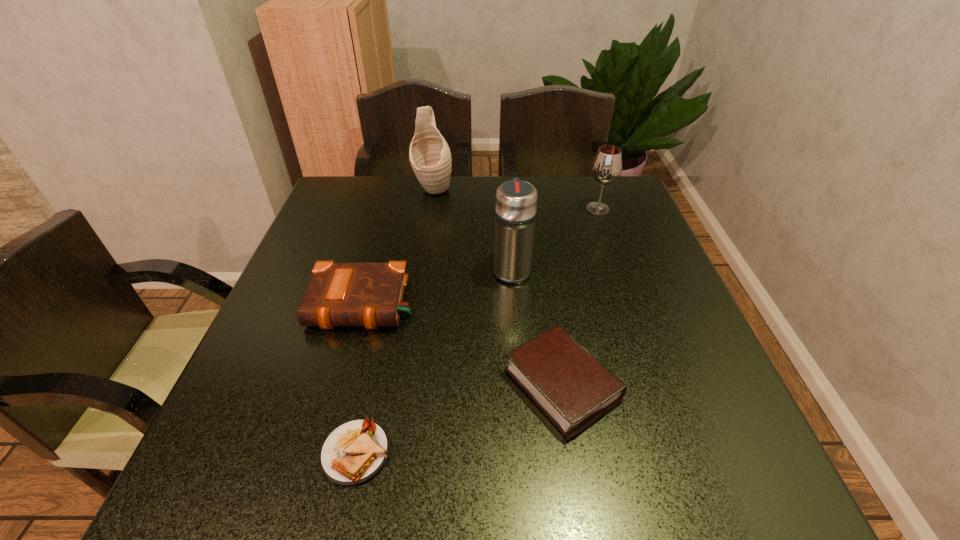
This screenshot has height=540, width=960. In order to click on vacant point that satisfies the following two spatial constraints: 1. at the spout of the fourth shortest object; 2. on the right side of the farthest object in this screenshot , I will do pos(430,208).